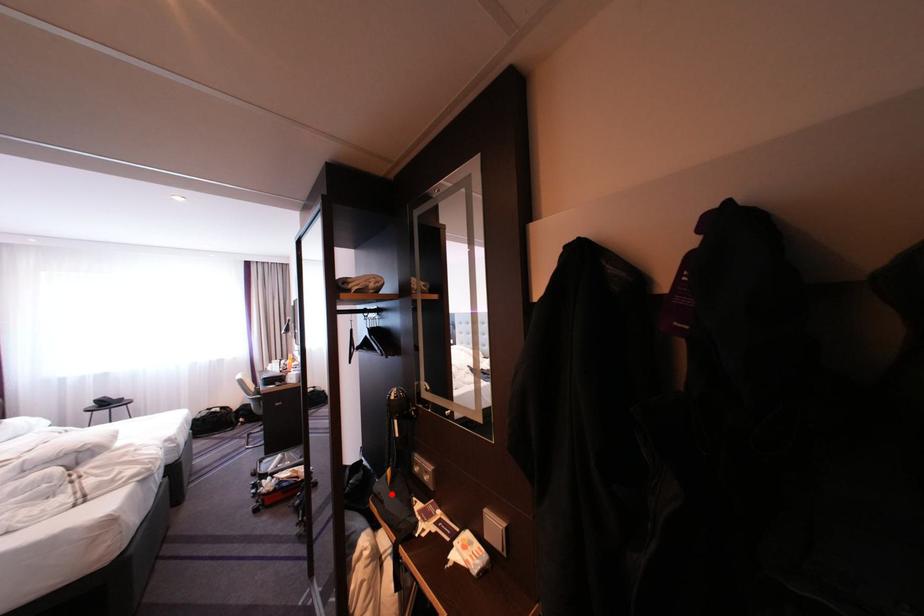
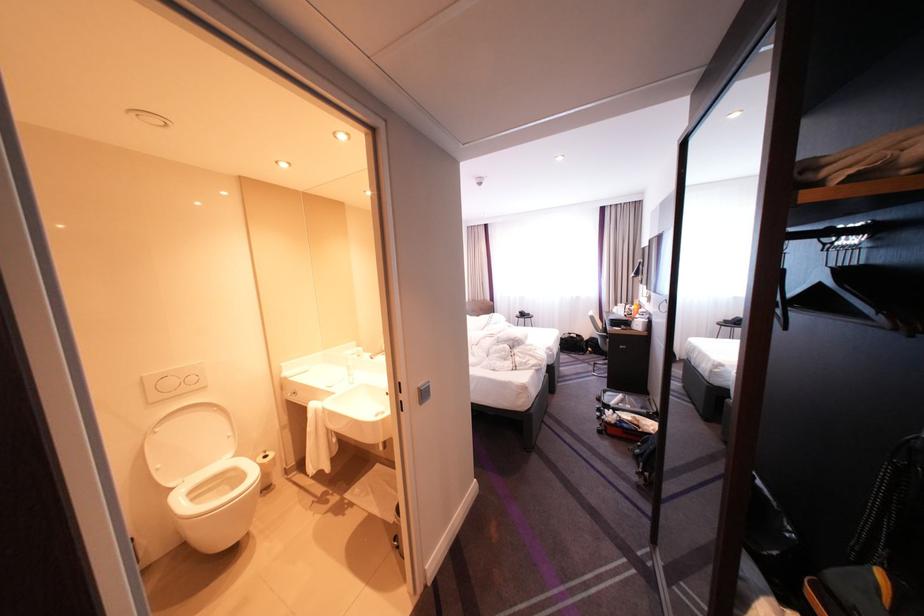
Find the pixel in the second image that matches the highlighted location in the first image.

(868, 610)